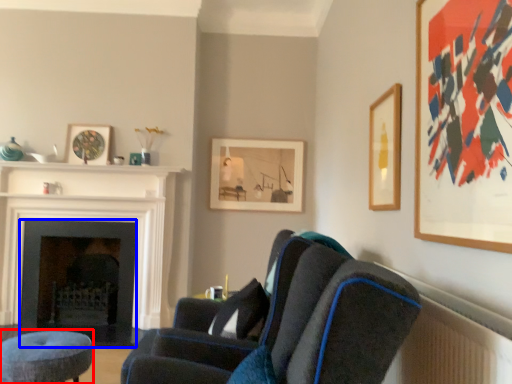
Question: Which point is further to the camera, stool (highlighted by a red box) or fireplace (highlighted by a blue box)?

Choices:
 (A) stool
 (B) fireplace

Answer: (B)